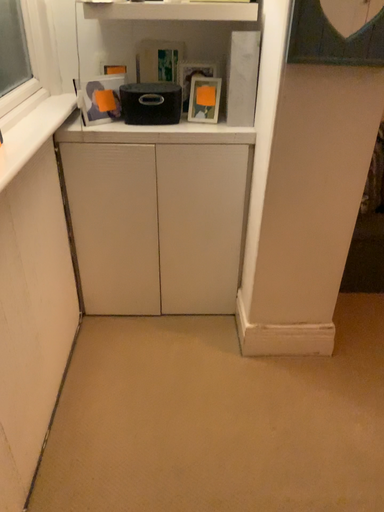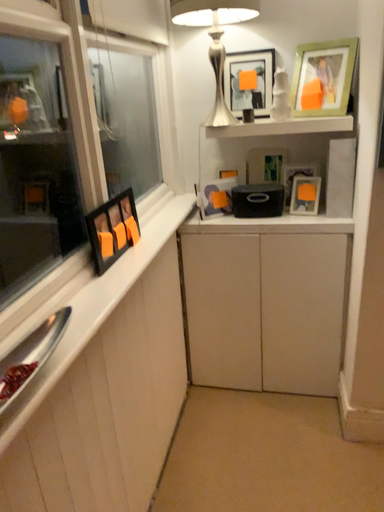
Question: How did the camera likely rotate when shooting the video?

Choices:
 (A) rotated left
 (B) rotated right

Answer: (A)